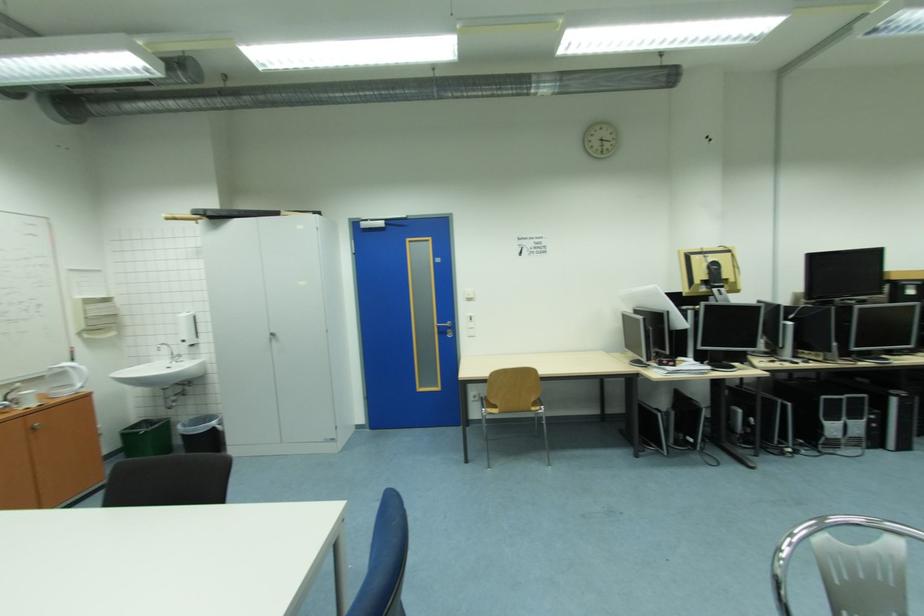
The height and width of the screenshot is (616, 924). What do you see at coordinates (444, 325) in the screenshot?
I see `the blue door handle` at bounding box center [444, 325].